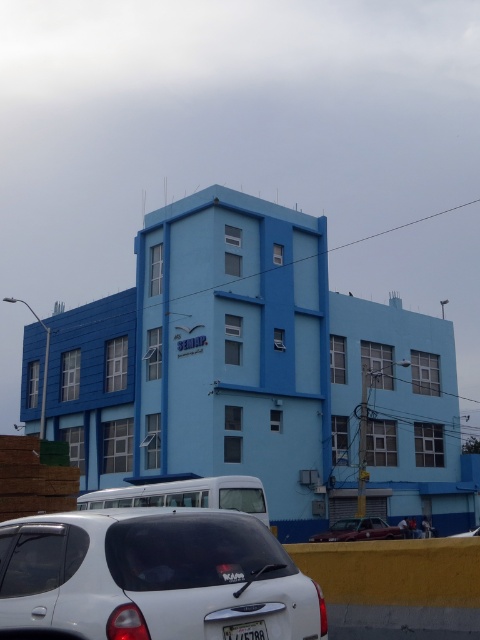
Question: Can you confirm if white matte hatchback at lower center is wider than shiny red car at center?

Choices:
 (A) yes
 (B) no

Answer: (A)

Question: Does white matte hatchback at lower center come behind white plastic license plate at lower center?

Choices:
 (A) no
 (B) yes

Answer: (A)

Question: Does white matte hatchback at lower center have a lesser width compared to metallic silver sedan at center?

Choices:
 (A) no
 (B) yes

Answer: (B)

Question: Which object appears closest to the camera in this image?

Choices:
 (A) white matte hatchback at lower center
 (B) white plastic license plate at lower center
 (C) shiny red car at center
 (D) metallic silver sedan at center

Answer: (A)

Question: Which object is closer to the camera taking this photo?

Choices:
 (A) metallic silver sedan at center
 (B) white plastic license plate at lower center
 (C) white matte hatchback at lower center
 (D) shiny red car at center

Answer: (C)

Question: Which object is positioned farthest from the white plastic license plate at lower center?

Choices:
 (A) shiny red car at center
 (B) metallic silver sedan at center

Answer: (B)